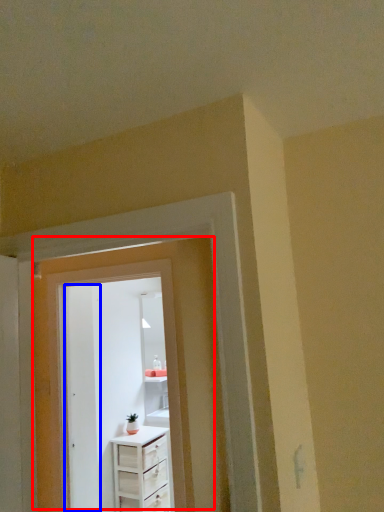
Question: Which object appears farthest to the camera in this image, door (highlighted by a red box) or door (highlighted by a blue box)?

Choices:
 (A) door
 (B) door

Answer: (B)